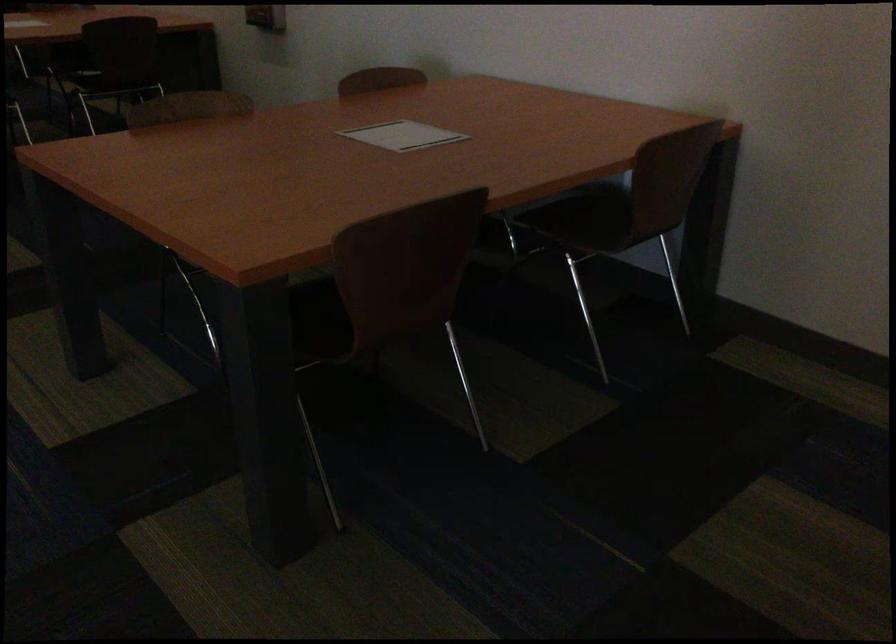
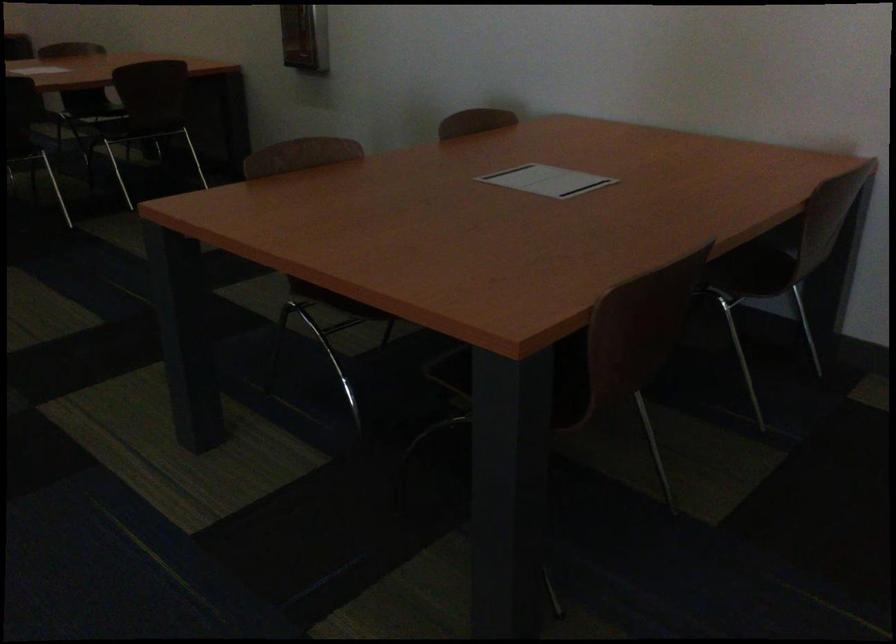
The point at (262, 305) is marked in the first image. Where is the corresponding point in the second image?

(526, 377)